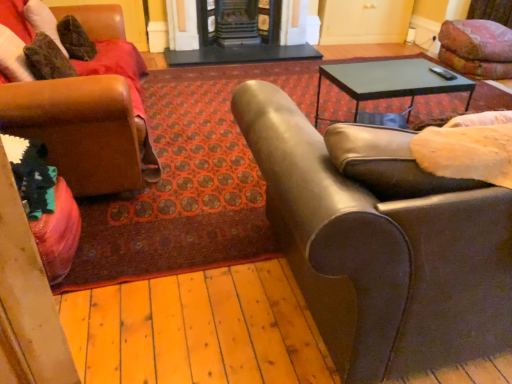
Identify the location of velvet pink cushion at upper right. This screenshot has height=384, width=512. (476, 48).

What do you see at coordinates (384, 257) in the screenshot?
I see `leather couch at right, the 1th chair viewed from the right` at bounding box center [384, 257].

The width and height of the screenshot is (512, 384). What do you see at coordinates (239, 20) in the screenshot? I see `marble fireplace at center, arranged as the 2th fireplace when viewed from the right` at bounding box center [239, 20].

How much space does marble fireplace at center, which is counted as the 1th fireplace, starting from the right, occupy horizontally?

It is 10.67 inches.

This screenshot has height=384, width=512. In order to click on velvet pink cushion at upper right in this screenshot , I will do `click(476, 48)`.

Does marble fireplace at center, which is counted as the 1th fireplace, starting from the right, appear on the right side of marble fireplace at center, which is the first fireplace from left to right?

Yes.

Considering the sizes of objects marble fireplace at center, which is counted as the 1th fireplace, starting from the right, and marble fireplace at center, which is the first fireplace from left to right, in the image provided, who is taller, marble fireplace at center, which is counted as the 1th fireplace, starting from the right, or marble fireplace at center, which is the first fireplace from left to right,?

With more height is marble fireplace at center, which is counted as the 1th fireplace, starting from the right.

Which is less distant, (307, 49) or (245, 35)?

Point (307, 49) appears to be farther away from the viewer than point (245, 35).

From their relative heights in the image, would you say metallic gray table at upper right is taller or shorter than marble fireplace at center, the second fireplace positioned from the left?

In the image, metallic gray table at upper right appears to be shorter than marble fireplace at center, the second fireplace positioned from the left.

From the metallic gray table at upper right, count 1st fireplaces backward and point to it. Please provide its 2D coordinates.

[(246, 34)]

Measure the distance from metallic gray table at upper right to marble fireplace at center, which is counted as the 1th fireplace, starting from the right.

They are 2.13 meters apart.

Who is more distant, metallic gray table at upper right or marble fireplace at center, which is counted as the 1th fireplace, starting from the right?

marble fireplace at center, which is counted as the 1th fireplace, starting from the right.

From a real-world perspective, is velvet pink cushion at upper right below marble fireplace at center, the second fireplace positioned from the left?

Correct, in the physical world, velvet pink cushion at upper right is lower than marble fireplace at center, the second fireplace positioned from the left.

How many degrees apart are the facing directions of velvet pink cushion at upper right and marble fireplace at center, the second fireplace positioned from the left?

The facing directions of velvet pink cushion at upper right and marble fireplace at center, the second fireplace positioned from the left, are 92.7 degrees apart.

In the scene shown: Would you say marble fireplace at center, the second fireplace positioned from the left, is part of velvet pink cushion at upper right's contents?

No, marble fireplace at center, the second fireplace positioned from the left, is located outside of velvet pink cushion at upper right.

Is point (469, 25) positioned after point (248, 42)?

No, (469, 25) is closer to viewer.

Would you say leather at left, the 1th chair in the left-to-right sequence, is outside leather couch at right, the 2th chair when ordered from left to right?

That's correct, leather at left, the 1th chair in the left-to-right sequence, is outside of leather couch at right, the 2th chair when ordered from left to right.

How different are the orientations of leather at left, which is the 2th chair from right to left, and leather couch at right, the 2th chair when ordered from left to right, in degrees?

There is a 88.4-degree angle between the facing directions of leather at left, which is the 2th chair from right to left, and leather couch at right, the 2th chair when ordered from left to right.

Which is in front, leather at left, which is the 2th chair from right to left, or leather couch at right, the 2th chair when ordered from left to right?

leather couch at right, the 2th chair when ordered from left to right, is closer to the camera.

Which is less distant, (126,137) or (302,47)?

The point (126,137) is closer.

Can you confirm if leather at left, which is the 2th chair from right to left, is bigger than marble fireplace at center, which is counted as the 1th fireplace, starting from the right?

Indeed, leather at left, which is the 2th chair from right to left, has a larger size compared to marble fireplace at center, which is counted as the 1th fireplace, starting from the right.

Locate an element on the screen. the 2nd fireplace to the right of the leather at left, which is the 2th chair from right to left, counting from the anchor's position is located at coordinates (246, 34).

From the image's perspective, is leather couch at right, the 2th chair when ordered from left to right, positioned above or below metallic gray table at upper right?

leather couch at right, the 2th chair when ordered from left to right, is below metallic gray table at upper right.

Considering the sizes of objects leather couch at right, the 1th chair viewed from the right, and metallic gray table at upper right in the image provided, who is bigger, leather couch at right, the 1th chair viewed from the right, or metallic gray table at upper right?

leather couch at right, the 1th chair viewed from the right.

From the picture: From a real-world perspective, who is located lower, leather couch at right, the 2th chair when ordered from left to right, or metallic gray table at upper right?

metallic gray table at upper right.

How different are the orientations of leather couch at right, the 1th chair viewed from the right, and metallic gray table at upper right in degrees?

The angular difference between leather couch at right, the 1th chair viewed from the right, and metallic gray table at upper right is 2.17 degrees.

Does point (420, 59) appear closer or farther from the camera than point (39, 113)?

Point (420, 59) is farther from the camera than point (39, 113).

Is metallic gray table at upper right positioned far away from leather at left, which is the 2th chair from right to left?

metallic gray table at upper right is positioned a significant distance from leather at left, which is the 2th chair from right to left.

Is metallic gray table at upper right inside the boundaries of leather at left, the 1th chair in the left-to-right sequence, or outside?

metallic gray table at upper right is outside leather at left, the 1th chair in the left-to-right sequence.

Locate an element on the screen. the 1st chair in front of the metallic gray table at upper right, starting your count from the anchor is located at coordinates pos(83,103).

You are a GUI agent. You are given a task and a screenshot of the screen. Output one action in this format:
    pyautogui.click(x=<x>, y=<y>)
    Task: Click on the fireplace on the right of marble fireplace at center, arranged as the 2th fireplace when viewed from the right
    Image resolution: width=512 pixels, height=384 pixels.
    Given the screenshot: What is the action you would take?
    click(x=246, y=34)

This screenshot has width=512, height=384. Find the location of `coffee table beneath the marble fireplace at center, the second fireplace positioned from the left (from a real-world perspective)`. coffee table beneath the marble fireplace at center, the second fireplace positioned from the left (from a real-world perspective) is located at coordinates (390, 81).

Based on the photo, considering their positions, is velvet pink cushion at upper right positioned closer to marble fireplace at center, which is counted as the 1th fireplace, starting from the right, than marble fireplace at center, arranged as the 2th fireplace when viewed from the right?

Among the two, marble fireplace at center, arranged as the 2th fireplace when viewed from the right, is located nearer to marble fireplace at center, which is counted as the 1th fireplace, starting from the right.

Looking at the image, which one is located further to leather couch at right, the 2th chair when ordered from left to right, marble fireplace at center, arranged as the 2th fireplace when viewed from the right, or black glossy table at center?

Among the two, marble fireplace at center, arranged as the 2th fireplace when viewed from the right, is located further to leather couch at right, the 2th chair when ordered from left to right.

Looking at the image, which one is located further to metallic gray table at upper right, velvet pink cushion at upper right or leather couch at right, the 1th chair viewed from the right?

leather couch at right, the 1th chair viewed from the right, lies further to metallic gray table at upper right than the other object.

When comparing their distances from leather couch at right, the 2th chair when ordered from left to right, does metallic gray table at upper right or marble fireplace at center, the second fireplace positioned from the left, seem closer?

metallic gray table at upper right is closer to leather couch at right, the 2th chair when ordered from left to right.

Estimate the real-world distances between objects in this image. Which object is further from leather at left, which is the 2th chair from right to left, marble fireplace at center, which is counted as the 1th fireplace, starting from the right, or metallic gray table at upper right?

Among the two, marble fireplace at center, which is counted as the 1th fireplace, starting from the right, is located further to leather at left, which is the 2th chair from right to left.

Based on their spatial positions, is marble fireplace at center, arranged as the 2th fireplace when viewed from the right, or leather at left, which is the 2th chair from right to left, further from black glossy table at center?

The object further to black glossy table at center is leather at left, which is the 2th chair from right to left.

Looking at the image, which one is located closer to black glossy table at center, marble fireplace at center, arranged as the 2th fireplace when viewed from the right, or velvet pink cushion at upper right?

marble fireplace at center, arranged as the 2th fireplace when viewed from the right, lies closer to black glossy table at center than the other object.

Which object lies nearer to the anchor point marble fireplace at center, the second fireplace positioned from the left, leather couch at right, the 1th chair viewed from the right, or leather at left, the 1th chair in the left-to-right sequence?

leather at left, the 1th chair in the left-to-right sequence, is positioned closer to the anchor marble fireplace at center, the second fireplace positioned from the left.

Locate an element on the screen. fireplace located between marble fireplace at center, which is the first fireplace from left to right, and velvet pink cushion at upper right in the left-right direction is located at coordinates (246, 34).

You are a GUI agent. You are given a task and a screenshot of the screen. Output one action in this format:
    pyautogui.click(x=<x>, y=<y>)
    Task: Click on the table positioned between leather couch at right, the 2th chair when ordered from left to right, and marble fireplace at center, the second fireplace positioned from the left, from near to far
    The width and height of the screenshot is (512, 384).
    Given the screenshot: What is the action you would take?
    pyautogui.click(x=240, y=54)

Find the location of a particular element. The width and height of the screenshot is (512, 384). coffee table between marble fireplace at center, which is counted as the 1th fireplace, starting from the right, and velvet pink cushion at upper right is located at coordinates (390, 81).

Where is `table between leather at left, which is the 2th chair from right to left, and marble fireplace at center, arranged as the 2th fireplace when viewed from the right, along the z-axis`? Image resolution: width=512 pixels, height=384 pixels. table between leather at left, which is the 2th chair from right to left, and marble fireplace at center, arranged as the 2th fireplace when viewed from the right, along the z-axis is located at coordinates (240, 54).